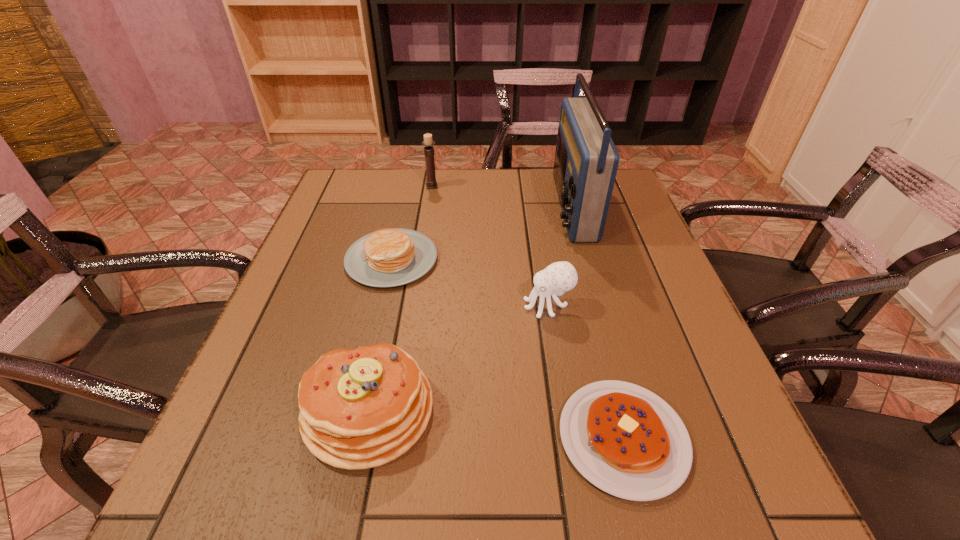
Locate an element on the screen. vacant area that lies between the fifth shortest object and the tallest object is located at coordinates (502, 197).

Find the location of `object that is the fifth closest to the radio receiver`. object that is the fifth closest to the radio receiver is located at coordinates (362, 408).

Locate which object is the third closest to the candle holder. Please provide its 2D coordinates. Your answer should be formatted as a tuple, i.e. [(x, y)], where the tuple contains the x and y coordinates of a point satisfying the conditions above.

[(559, 277)]

Identify the location of the closest pancake to the rightmost pancake. (362, 408).

Identify which pancake is located as the third nearest to the octopus. Please provide its 2D coordinates. Your answer should be formatted as a tuple, i.e. [(x, y)], where the tuple contains the x and y coordinates of a point satisfying the conditions above.

[(362, 408)]

Identify the location of free spot that satisfies the following two spatial constraints: 1. on the front side of the farthest pancake; 2. on the right side of the shortest pancake. (350, 438).

Find the location of `vacant space that satisfies the following two spatial constraints: 1. on the front-facing side of the shortest pancake; 2. on the right side of the octopus`. vacant space that satisfies the following two spatial constraints: 1. on the front-facing side of the shortest pancake; 2. on the right side of the octopus is located at coordinates (569, 438).

Where is `vacant area in the image that satisfies the following two spatial constraints: 1. on the front-facing side of the octopus; 2. on the right side of the shortest pancake`? vacant area in the image that satisfies the following two spatial constraints: 1. on the front-facing side of the octopus; 2. on the right side of the shortest pancake is located at coordinates (569, 438).

Where is `vacant space that satisfies the following two spatial constraints: 1. on the front-facing side of the rightmost pancake; 2. on the left side of the third nearest object`? vacant space that satisfies the following two spatial constraints: 1. on the front-facing side of the rightmost pancake; 2. on the left side of the third nearest object is located at coordinates (569, 438).